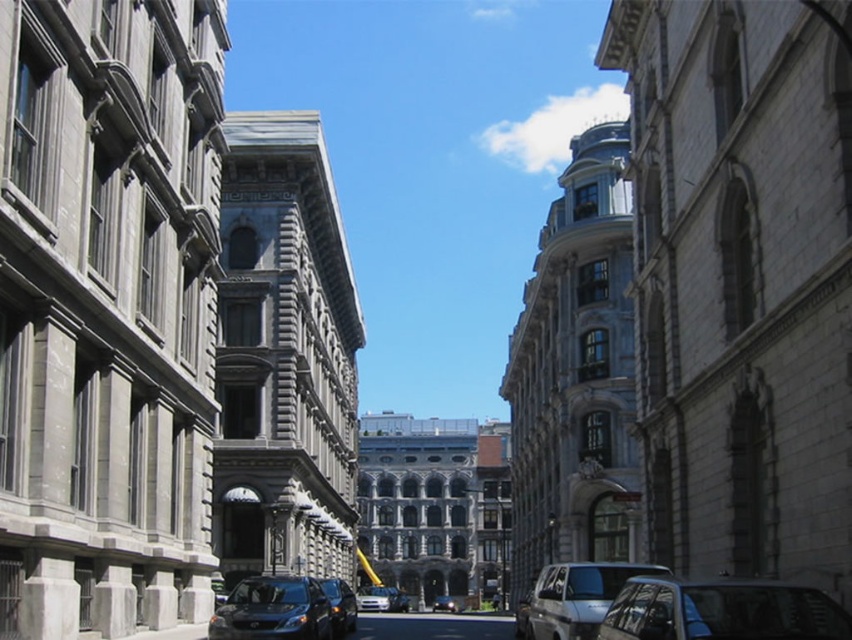
You are a delivery person who needs to park your motorcycle between the metallic silver car at lower right and the nearest building. Can you fit your motorcycle there if it requires 4 meters of space?

The metallic silver car at lower right is 41.63 meters away from the nearest building, so yes, the motorcycle can fit as there is sufficient space between them.

You are standing at the center of the street in the historic urban area. You need to cross the street to reach the other side. Is the metallic silver car at lower right positioned to your right or left side as you face the direction of the street?

The metallic silver car at lower right is positioned to your right side as you face the direction of the street because its 2D coordinates at point (721, 611) place it in the lower right quadrant of the image, which corresponds to your right side when facing the street.